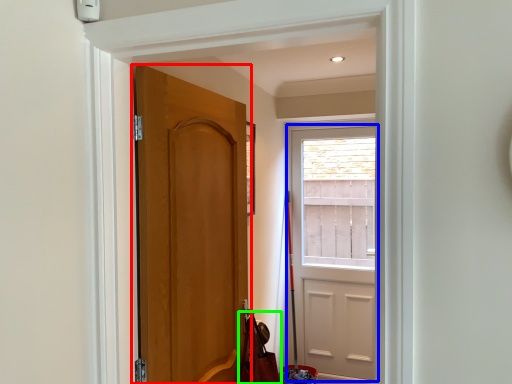
Question: Estimate the real-world distances between objects in this image. Which object is farther from door (highlighted by a red box), door (highlighted by a blue box) or shoulder bag (highlighted by a green box)?

Choices:
 (A) door
 (B) shoulder bag

Answer: (A)